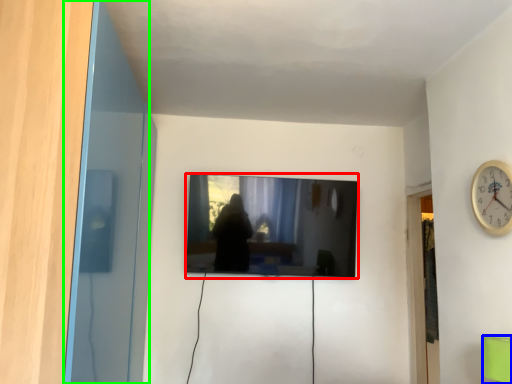
Question: Which object is the farthest from television (highlighted by a red box)? Choose among these: furniture (highlighted by a blue box) or glass door (highlighted by a green box).

Choices:
 (A) furniture
 (B) glass door

Answer: (A)